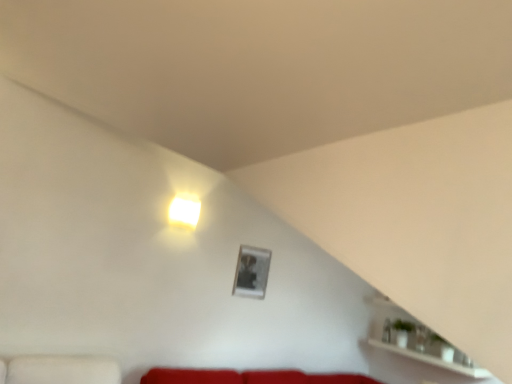
Describe the element at coordinates (251, 272) in the screenshot. The image size is (512, 384). I see `metallic silver picture frame at upper center` at that location.

Identify the location of white glossy shelf at lower right. (416, 341).

This screenshot has width=512, height=384. I want to click on metallic silver picture frame at upper center, so 251,272.

Is metallic silver picture frame at upper center not close to white glossy cube at upper center?

metallic silver picture frame at upper center is actually quite close to white glossy cube at upper center.

Is metallic silver picture frame at upper center to the right of white glossy cube at upper center from the viewer's perspective?

Yes, metallic silver picture frame at upper center is to the right of white glossy cube at upper center.

Does metallic silver picture frame at upper center have a lesser height compared to white glossy cube at upper center?

No, metallic silver picture frame at upper center is not shorter than white glossy cube at upper center.

Is metallic silver picture frame at upper center looking in the opposite direction of white glossy cube at upper center?

No, metallic silver picture frame at upper center is not facing the opposite direction of white glossy cube at upper center.

Is white glossy cube at upper center closer to the viewer compared to metallic silver picture frame at upper center?

Yes, the depth of white glossy cube at upper center is less than that of metallic silver picture frame at upper center.

Can you confirm if white glossy cube at upper center is smaller than metallic silver picture frame at upper center?

Actually, white glossy cube at upper center might be larger than metallic silver picture frame at upper center.

Is point (192, 204) positioned before point (256, 289)?

Yes, point (192, 204) is closer to viewer.

Is white glossy cube at upper center facing towards metallic silver picture frame at upper center?

No, white glossy cube at upper center is not facing towards metallic silver picture frame at upper center.

Is white glossy shelf at lower right shorter than metallic silver picture frame at upper center?

Indeed, white glossy shelf at lower right has a lesser height compared to metallic silver picture frame at upper center.

From a real-world perspective, which is physically below, white glossy shelf at lower right or metallic silver picture frame at upper center?

From a 3D spatial view, white glossy shelf at lower right is below.

Is white glossy shelf at lower right looking in the opposite direction of metallic silver picture frame at upper center?

That's not correct — white glossy shelf at lower right is not looking away from metallic silver picture frame at upper center.

Considering the points (406, 316) and (256, 284), which point is behind, point (406, 316) or point (256, 284)?

Positioned behind is point (406, 316).

Is metallic silver picture frame at upper center wider or thinner than white glossy shelf at lower right?

Clearly, metallic silver picture frame at upper center has less width compared to white glossy shelf at lower right.

Which is less distant, (244, 262) or (469, 374)?

Point (244, 262) is positioned farther from the camera compared to point (469, 374).

Is white glossy shelf at lower right surrounded by metallic silver picture frame at upper center?

→ No, white glossy shelf at lower right is not inside metallic silver picture frame at upper center.

Based on the photo, considering the relative sizes of metallic silver picture frame at upper center and white glossy shelf at lower right in the image provided, is metallic silver picture frame at upper center smaller than white glossy shelf at lower right?

Correct, metallic silver picture frame at upper center occupies less space than white glossy shelf at lower right.

Can you tell me how much white glossy cube at upper center and white glossy shelf at lower right differ in facing direction?

white glossy cube at upper center and white glossy shelf at lower right are facing 89.4 degrees away from each other.

Is white glossy cube at upper center taller or shorter than white glossy shelf at lower right?

white glossy cube at upper center is shorter than white glossy shelf at lower right.

Looking at this image, is the depth of white glossy cube at upper center less than that of white glossy shelf at lower right?

No.

Which object is positioned more to the right, white glossy cube at upper center or white glossy shelf at lower right?

white glossy shelf at lower right.

From the image's perspective, is white glossy shelf at lower right located above or below white glossy cube at upper center?

white glossy shelf at lower right is below white glossy cube at upper center.

Is point (403, 312) farther from viewer compared to point (191, 197)?

Yes.

Where is `picture frame on the right of white glossy cube at upper center`? picture frame on the right of white glossy cube at upper center is located at coordinates (251, 272).

There is a metallic silver picture frame at upper center. Where is `lamp above it (from a real-world perspective)`? The width and height of the screenshot is (512, 384). lamp above it (from a real-world perspective) is located at coordinates (185, 210).

Considering their positions, is white glossy cube at upper center positioned closer to white glossy shelf at lower right than metallic silver picture frame at upper center?

metallic silver picture frame at upper center is positioned closer to the anchor white glossy shelf at lower right.

Considering their positions, is metallic silver picture frame at upper center positioned closer to white glossy shelf at lower right than white glossy cube at upper center?

metallic silver picture frame at upper center.

Considering their positions, is white glossy shelf at lower right positioned further to white glossy cube at upper center than metallic silver picture frame at upper center?

The object further to white glossy cube at upper center is white glossy shelf at lower right.

Based on their spatial positions, is white glossy shelf at lower right or white glossy cube at upper center further from metallic silver picture frame at upper center?

white glossy shelf at lower right is further to metallic silver picture frame at upper center.

When comparing their distances from metallic silver picture frame at upper center, does white glossy cube at upper center or white glossy shelf at lower right seem further?

The object further to metallic silver picture frame at upper center is white glossy shelf at lower right.

Estimate the real-world distances between objects in this image. Which object is closer to white glossy cube at upper center, metallic silver picture frame at upper center or white glossy shelf at lower right?

metallic silver picture frame at upper center lies closer to white glossy cube at upper center than the other object.

You are a GUI agent. You are given a task and a screenshot of the screen. Output one action in this format:
    pyautogui.click(x=<x>, y=<y>)
    Task: Click on the picture frame between white glossy cube at upper center and white glossy shelf at lower right from left to right
    Image resolution: width=512 pixels, height=384 pixels.
    Given the screenshot: What is the action you would take?
    (x=251, y=272)